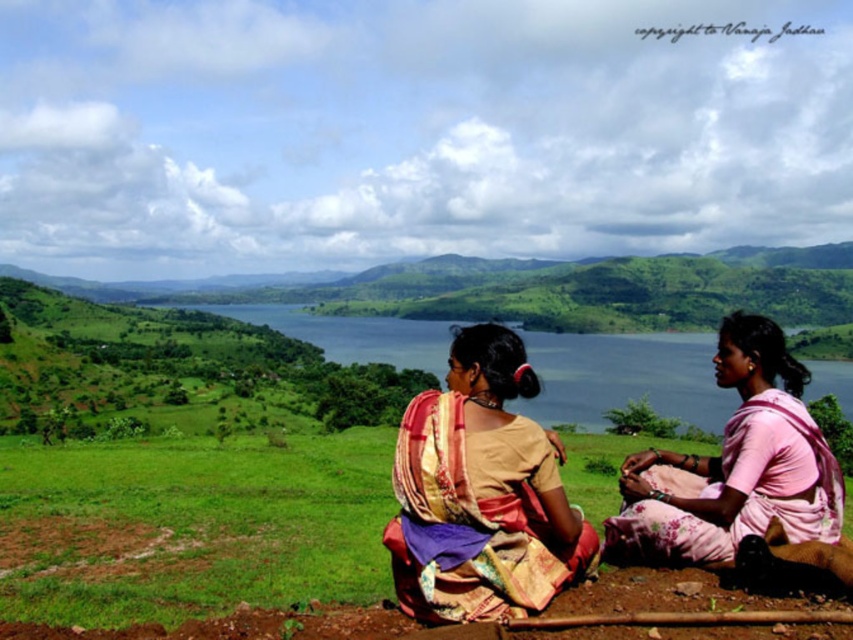
Is multicolored silk saree at center above blue water at center?

Actually, multicolored silk saree at center is below blue water at center.

Describe the element at coordinates (480, 493) in the screenshot. The height and width of the screenshot is (640, 853). I see `multicolored silk saree at center` at that location.

I want to click on multicolored silk saree at center, so click(480, 493).

Describe the element at coordinates (480, 493) in the screenshot. This screenshot has width=853, height=640. I see `multicolored silk saree at center` at that location.

Does multicolored silk saree at center have a larger size compared to pink satin saree at lower right?

Incorrect, multicolored silk saree at center is not larger than pink satin saree at lower right.

Is point (479, 589) positioned behind point (809, 442)?

No, it is in front of (809, 442).

You are a GUI agent. You are given a task and a screenshot of the screen. Output one action in this format:
    pyautogui.click(x=<x>, y=<y>)
    Task: Click on the multicolored silk saree at center
    This screenshot has height=640, width=853.
    Given the screenshot: What is the action you would take?
    pyautogui.click(x=480, y=493)

Which is below, pink satin saree at lower right or blue water at center?

pink satin saree at lower right

Can you confirm if pink satin saree at lower right is taller than blue water at center?

No.

Describe the element at coordinates (733, 467) in the screenshot. This screenshot has height=640, width=853. I see `pink satin saree at lower right` at that location.

Identify the location of pink satin saree at lower right. The width and height of the screenshot is (853, 640). (733, 467).